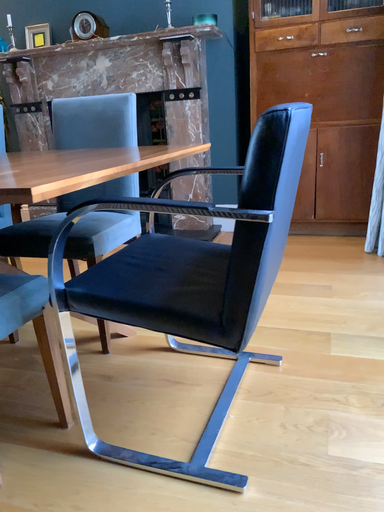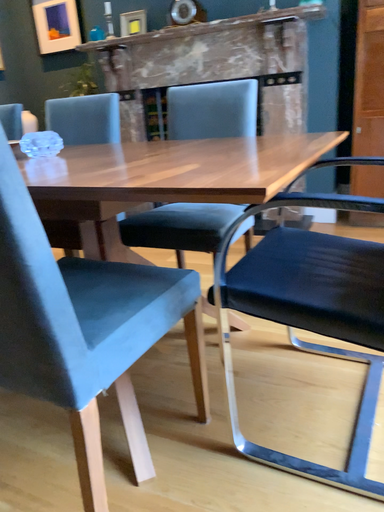
Question: Which way did the camera rotate in the video?

Choices:
 (A) rotated right
 (B) rotated left

Answer: (B)